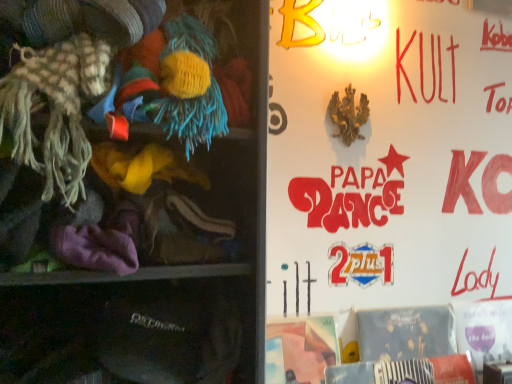
Image resolution: width=512 pixels, height=384 pixels. I want to click on fuzzy fabric at left, so click(x=128, y=196).

Measure the distance between point (59,235) and camera.

The distance of point (59,235) from camera is 23.86 inches.

Image resolution: width=512 pixels, height=384 pixels. What do you see at coordinates (128, 196) in the screenshot?
I see `fuzzy fabric at left` at bounding box center [128, 196].

This screenshot has height=384, width=512. What are the coordinates of `fuzzy fabric at left` in the screenshot? It's located at (128, 196).